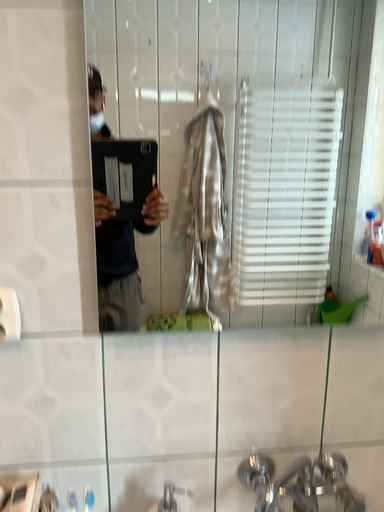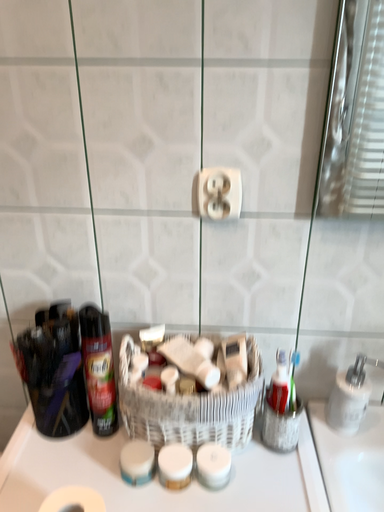
Question: Which way did the camera rotate in the video?

Choices:
 (A) rotated upward
 (B) rotated downward

Answer: (B)